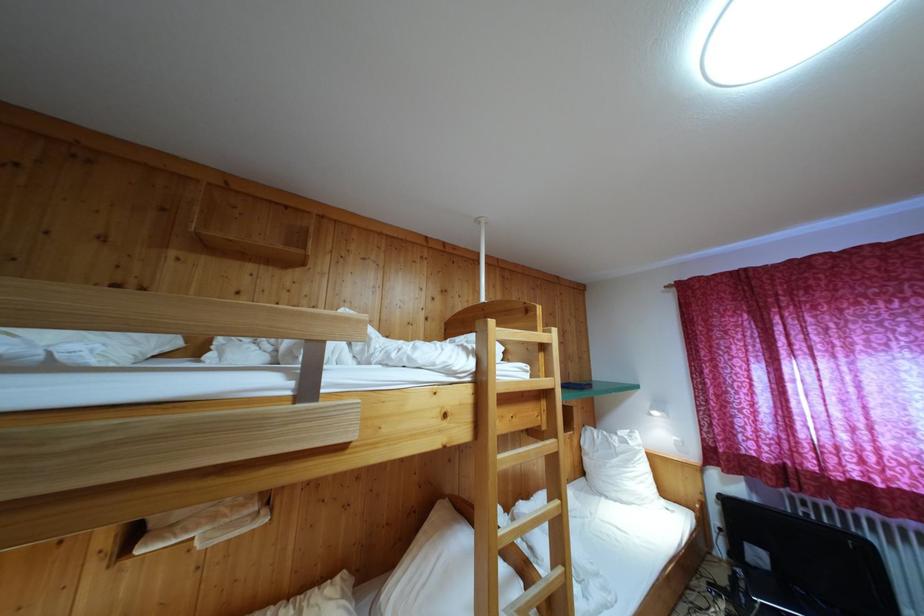
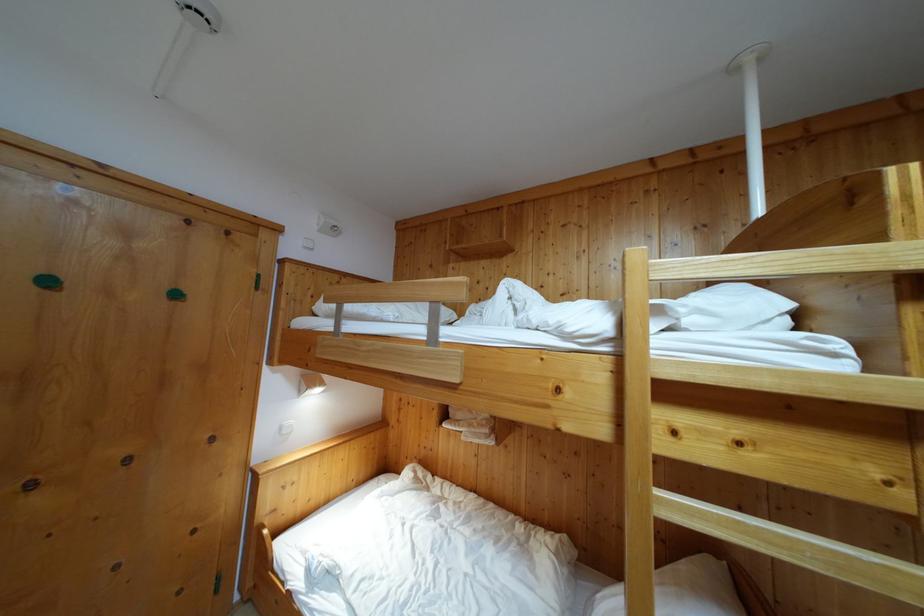
Where in the second image is the point corresponding to point (539, 336) from the first image?

(881, 245)